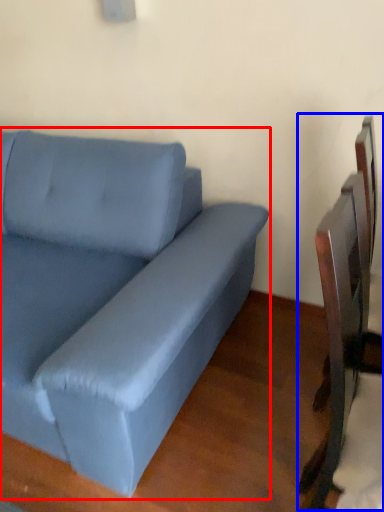
Question: Which point is further to the camera, studio couch (highlighted by a red box) or swivel chair (highlighted by a blue box)?

Choices:
 (A) studio couch
 (B) swivel chair

Answer: (B)